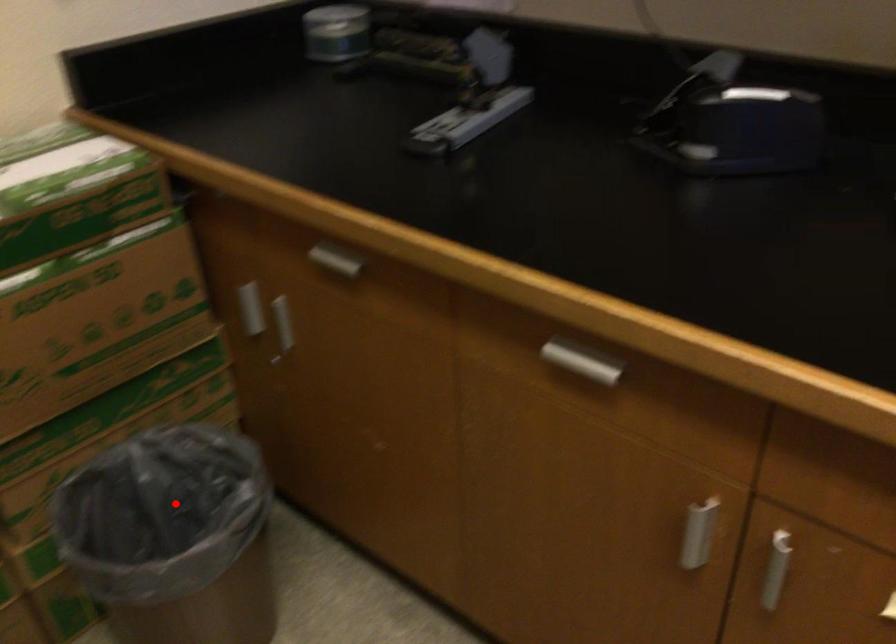
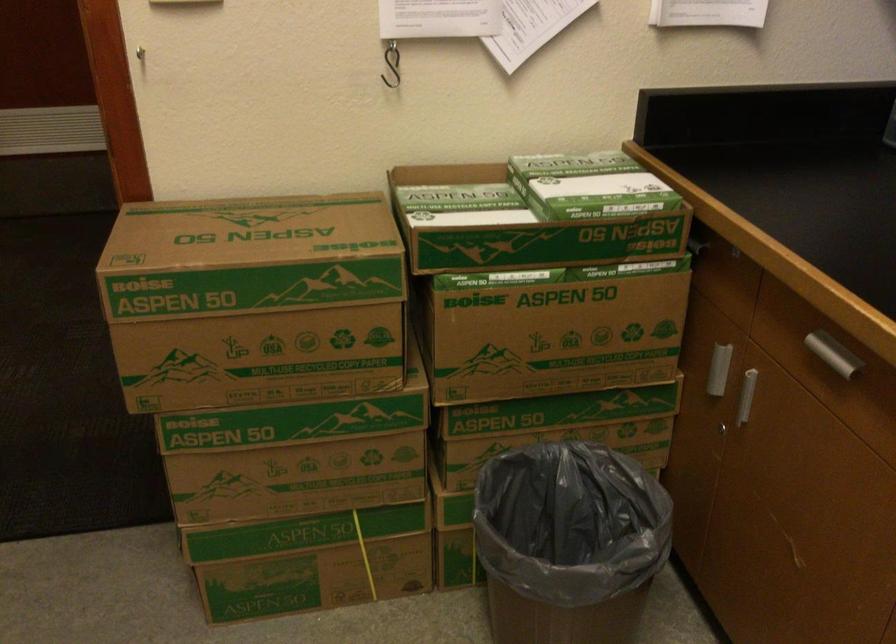
In the second image, find the point that corresponds to the highlighted location in the first image.

(570, 521)